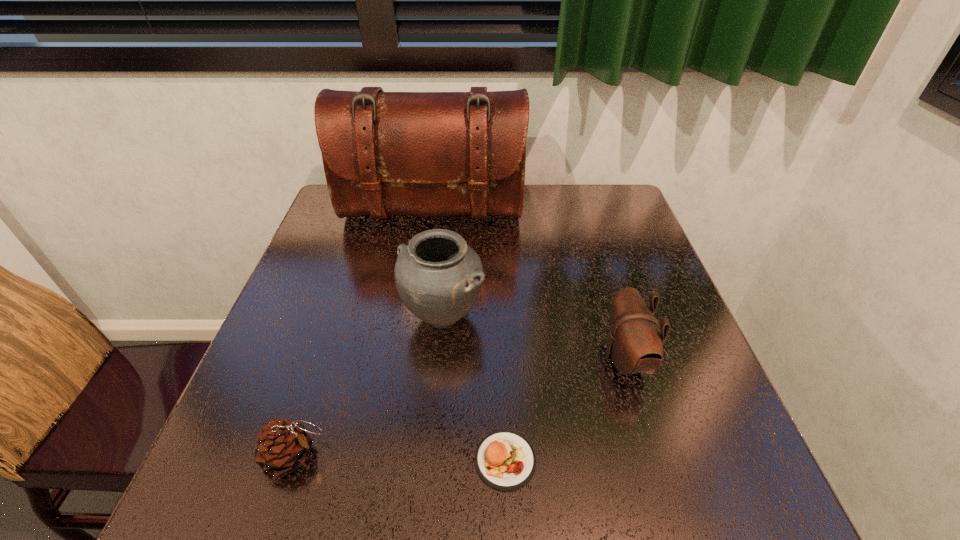
Locate which object is the fourth closest to the patty (food). Please provide its 2D coordinates. Your answer should be formatted as a tuple, i.e. [(x, y)], where the tuple contains the x and y coordinates of a point satisfying the conditions above.

[(384, 153)]

Locate which object is the fourth closest to the urn. Please provide its 2D coordinates. Your answer should be formatted as a tuple, i.e. [(x, y)], where the tuple contains the x and y coordinates of a point satisfying the conditions above.

[(635, 345)]

Identify the location of free space that satisfies the following two spatial constraints: 1. on the front-facing side of the tallest object; 2. on the left side of the fourth shortest object. Image resolution: width=960 pixels, height=540 pixels. (418, 316).

This screenshot has height=540, width=960. Identify the location of free location that satisfies the following two spatial constraints: 1. with a leaf charm attached to the fourth tallest object; 2. on the right side of the patty (food). (293, 460).

Where is `vacant space that satisfies the following two spatial constraints: 1. on the front-facing side of the satchel; 2. on the right side of the fourth shortest object`? The image size is (960, 540). vacant space that satisfies the following two spatial constraints: 1. on the front-facing side of the satchel; 2. on the right side of the fourth shortest object is located at coordinates (418, 316).

You are a GUI agent. You are given a task and a screenshot of the screen. Output one action in this format:
    pyautogui.click(x=<x>, y=<y>)
    Task: Click on the free space that satisfies the following two spatial constraints: 1. on the front-facing side of the farthest object; 2. with a leaf charm attached to the pinecone
    
    Given the screenshot: What is the action you would take?
    pyautogui.click(x=398, y=456)

The image size is (960, 540). I want to click on vacant region that satisfies the following two spatial constraints: 1. on the front-facing side of the satchel; 2. on the left side of the patty (food), so click(x=397, y=460).